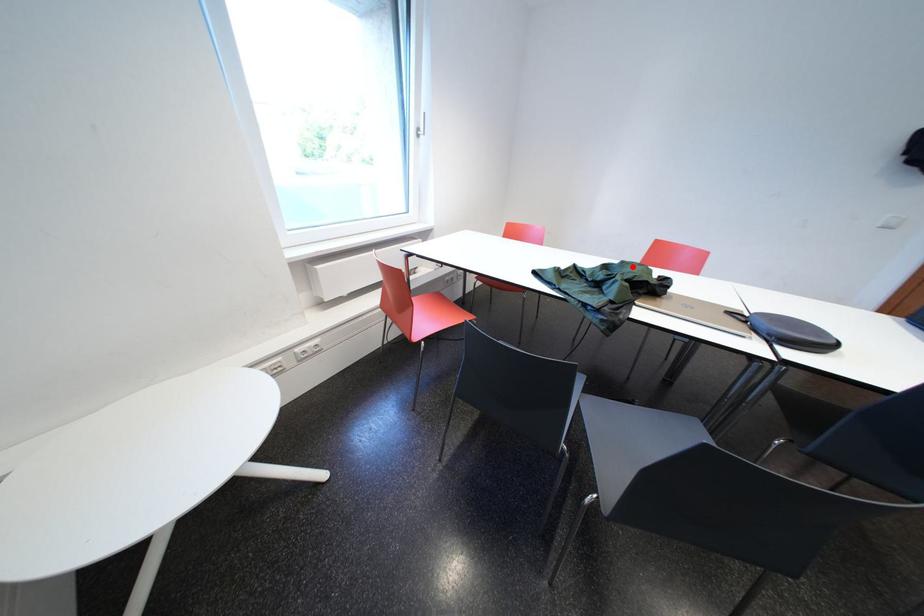
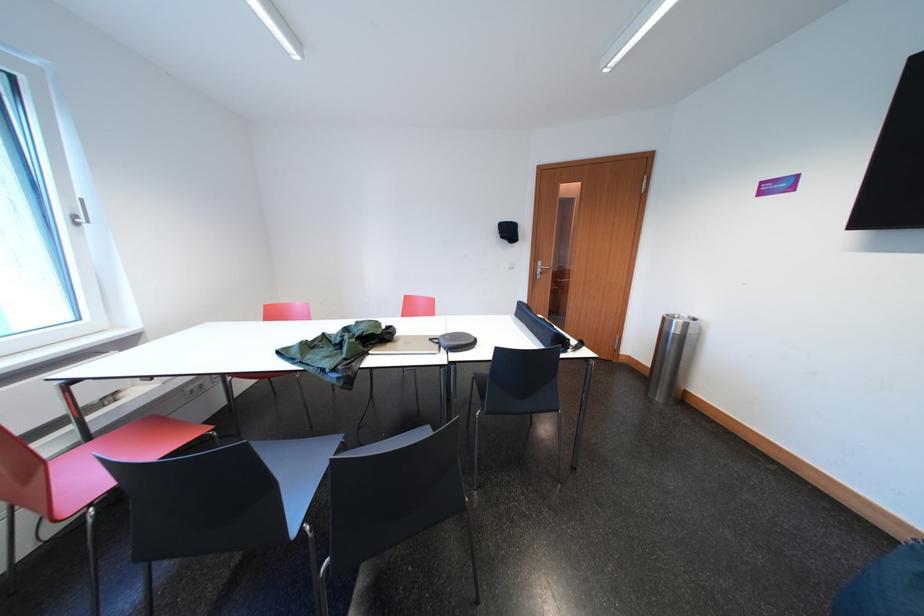
Where in the second image is the point corresponding to the highlighted location from the first image?

(367, 326)